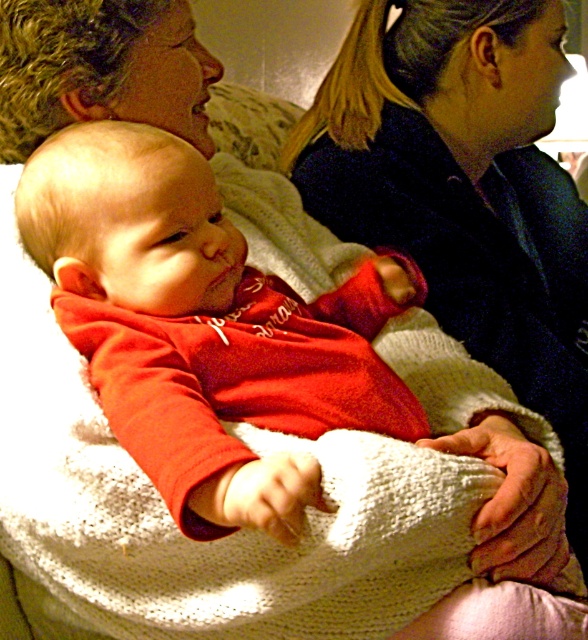
Is matte red sweater at center taller than matte black sweater at upper right?

Incorrect, matte red sweater at center's height is not larger of matte black sweater at upper right's.

Is matte red sweater at center above matte black sweater at upper right?

Incorrect, matte red sweater at center is not positioned above matte black sweater at upper right.

Where is `matte red sweater at center`? Image resolution: width=588 pixels, height=640 pixels. matte red sweater at center is located at coordinates (205, 328).